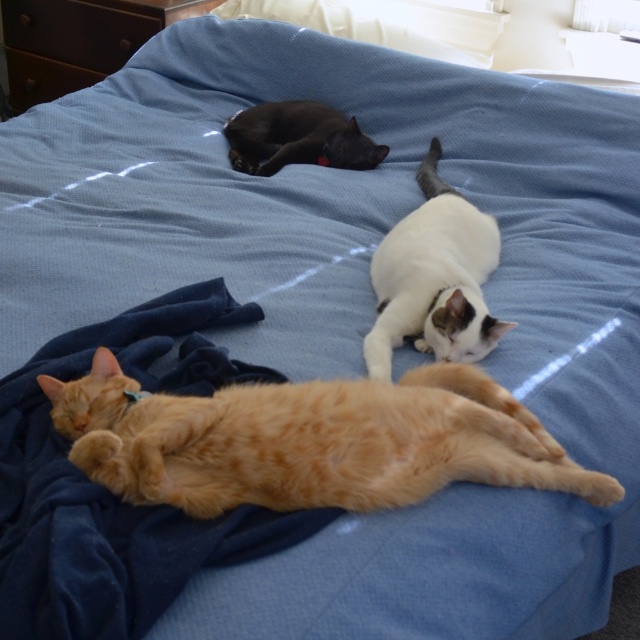
Can you confirm if orange fur cat at lower left is positioned above brown wood dresser at upper left?

Actually, orange fur cat at lower left is below brown wood dresser at upper left.

Can you confirm if orange fur cat at lower left is positioned to the right of brown wood dresser at upper left?

Indeed, orange fur cat at lower left is positioned on the right side of brown wood dresser at upper left.

Describe the element at coordinates (308, 440) in the screenshot. Image resolution: width=640 pixels, height=640 pixels. I see `orange fur cat at lower left` at that location.

Locate an element on the screen. orange fur cat at lower left is located at coordinates (308, 440).

Is velvety blue blanket at lower left further to the viewer compared to brown wood dresser at upper left?

No, velvety blue blanket at lower left is in front of brown wood dresser at upper left.

Does velvety blue blanket at lower left have a lesser height compared to brown wood dresser at upper left?

In fact, velvety blue blanket at lower left may be taller than brown wood dresser at upper left.

Which is in front, point (3, 480) or point (68, 32)?

Positioned in front is point (3, 480).

Find the location of a particular element. velvety blue blanket at lower left is located at coordinates (115, 496).

Is point (476, 326) positioned behind point (289, 163)?

That is False.

Which of these two, white fur cat at center or shiny black cat at center, stands shorter?

With less height is shiny black cat at center.

At what (x,y) coordinates should I click in order to perform the action: click on white fur cat at center. Please return your answer as a coordinate pair (x, y). The width and height of the screenshot is (640, 640). Looking at the image, I should click on (435, 278).

Where is `white fur cat at center`? The height and width of the screenshot is (640, 640). white fur cat at center is located at coordinates (x=435, y=278).